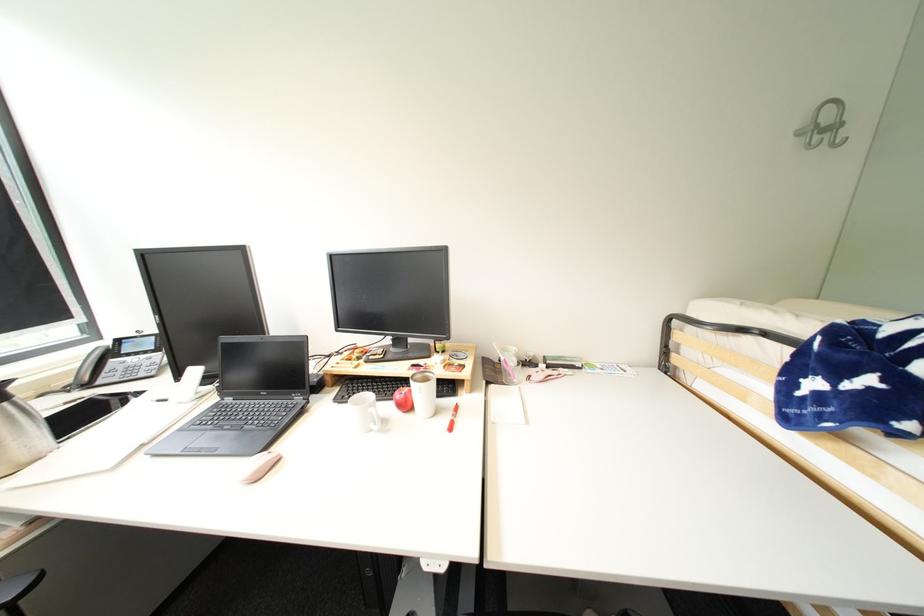
Describe the element at coordinates (91, 367) in the screenshot. I see `the phone handset` at that location.